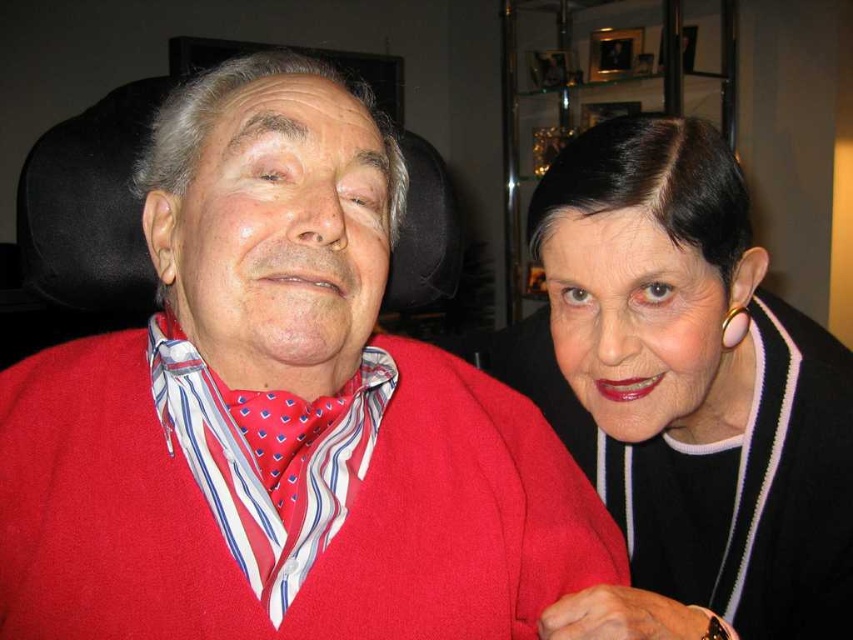
Question: Can you confirm if matte red sweater at center is positioned below black matte sweater at upper right?

Choices:
 (A) no
 (B) yes

Answer: (A)

Question: Is matte red sweater at center above black matte sweater at upper right?

Choices:
 (A) yes
 (B) no

Answer: (A)

Question: Among these objects, which one is farthest from the camera?

Choices:
 (A) matte red sweater at center
 (B) black matte sweater at upper right

Answer: (A)

Question: Does matte red sweater at center have a lesser width compared to black matte sweater at upper right?

Choices:
 (A) no
 (B) yes

Answer: (A)

Question: Which point is farther from the camera taking this photo?

Choices:
 (A) (550, 268)
 (B) (389, 422)

Answer: (A)